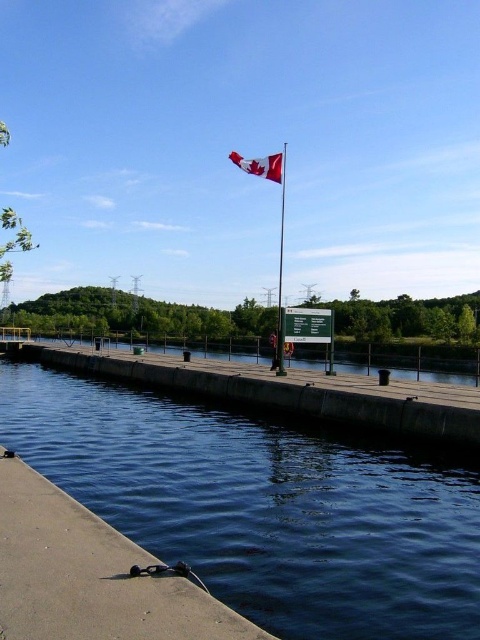
Does concrete dock at lower left have a larger size compared to red fabric flag at upper center?

No, concrete dock at lower left is not bigger than red fabric flag at upper center.

Is point (54, 600) farther from viewer compared to point (255, 173)?

No, it is not.

Describe the element at coordinates (90, 576) in the screenshot. I see `concrete dock at lower left` at that location.

Identify the location of concrete dock at lower left. This screenshot has width=480, height=640. (90, 576).

Which is more to the right, polished metal flag pole at upper center or red fabric flag at upper center?

polished metal flag pole at upper center

Does polished metal flag pole at upper center have a lesser width compared to red fabric flag at upper center?

Indeed, polished metal flag pole at upper center has a lesser width compared to red fabric flag at upper center.

The height and width of the screenshot is (640, 480). I want to click on polished metal flag pole at upper center, so click(x=280, y=260).

Who is more distant from viewer, (67, 572) or (282, 202)?

Positioned behind is point (282, 202).

What do you see at coordinates (90, 576) in the screenshot? I see `concrete dock at lower left` at bounding box center [90, 576].

Between point (78, 556) and point (276, 362), which one is positioned in front?

Point (78, 556)

Locate an element on the screen. This screenshot has height=640, width=480. concrete dock at lower left is located at coordinates tap(90, 576).